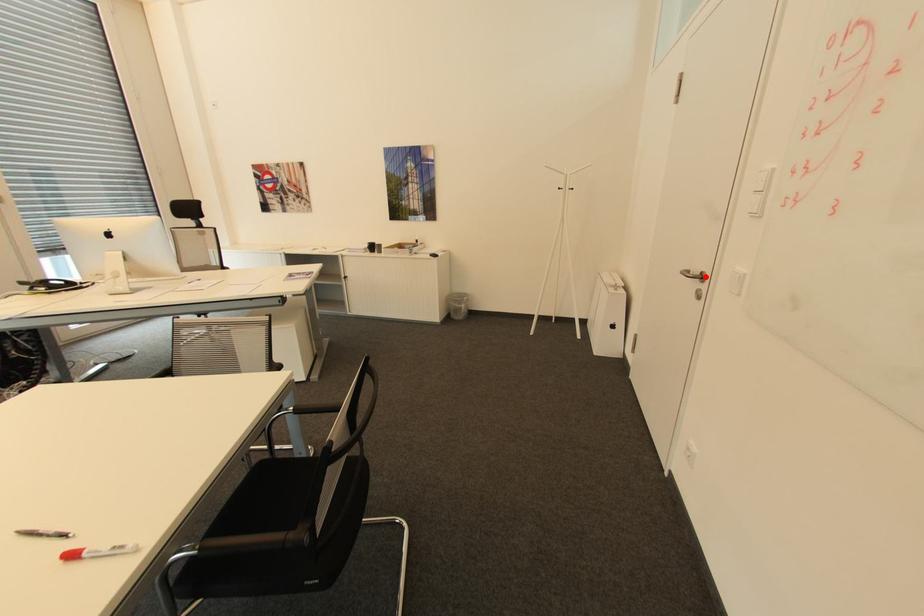
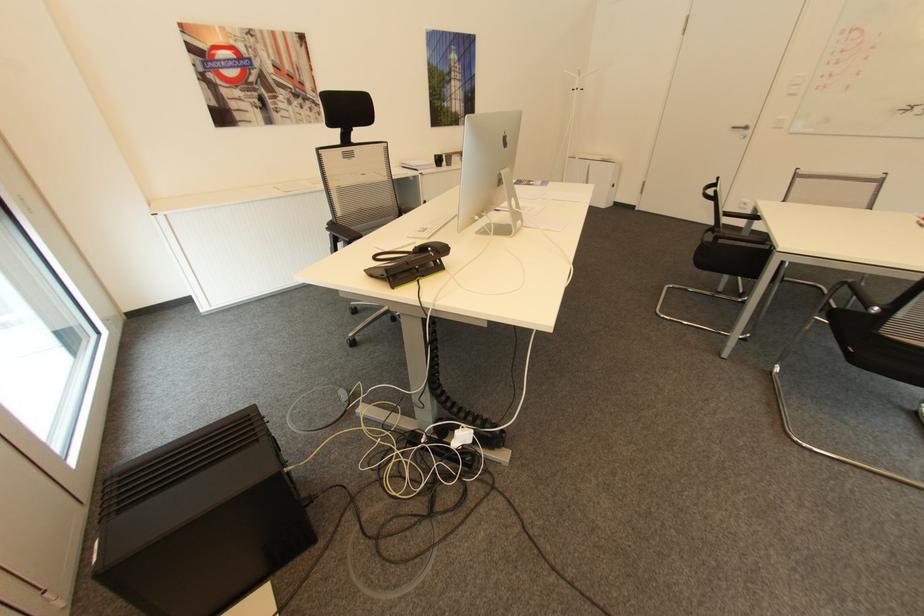
Find the pixel in the second image that matches the highlighted location in the first image.

(749, 128)